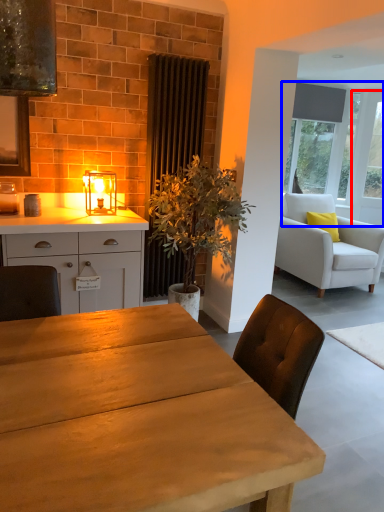
Question: Which object appears closest to the camera in this image, glass door (highlighted by a red box) or window (highlighted by a blue box)?

Choices:
 (A) glass door
 (B) window

Answer: (B)